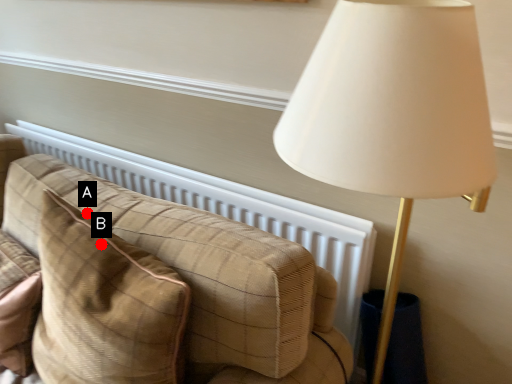
Question: Two points are circled on the image, labeled by A and B beside each circle. Among these points, which one is farthest from the camera?

Choices:
 (A) A is further
 (B) B is further

Answer: (A)